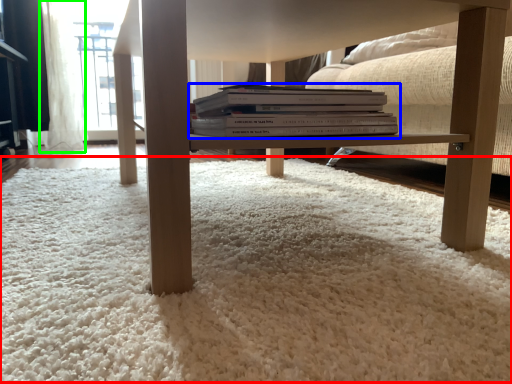
Question: Which is nearer to the plain (highlighted by a red box)? book (highlighted by a blue box) or curtain (highlighted by a green box).

Choices:
 (A) book
 (B) curtain

Answer: (A)